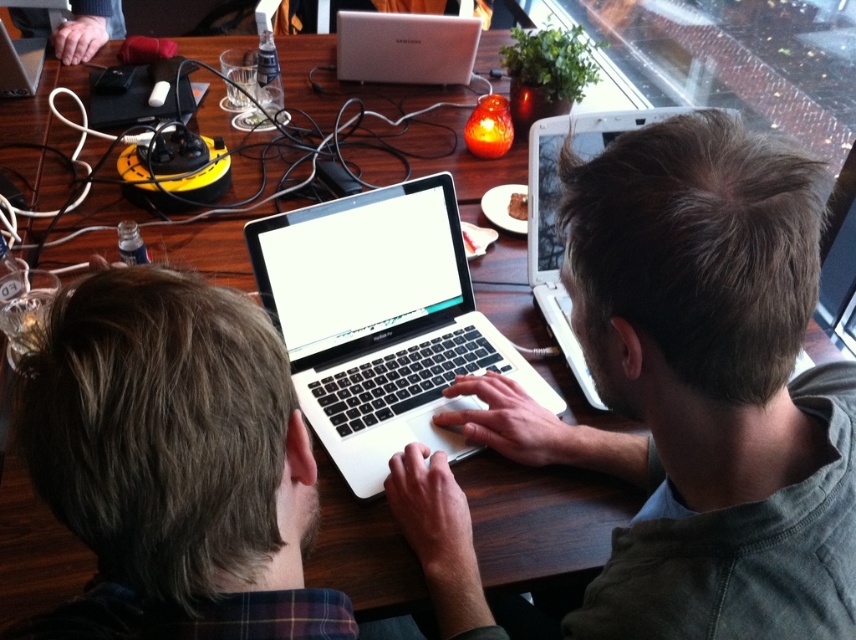
Question: Which point appears closest to the camera in this image?

Choices:
 (A) (354, 28)
 (B) (625, 627)
 (C) (314, 264)
 (D) (652, 115)

Answer: (B)

Question: Which point is farther from the camera taking this photo?

Choices:
 (A) (611, 563)
 (B) (462, 83)

Answer: (B)

Question: Does silver metallic laptop at upper center appear on the right side of satin silver laptop at upper center?

Choices:
 (A) no
 (B) yes

Answer: (B)

Question: Which of the following is the farthest from the observer?

Choices:
 (A) (464, 44)
 (B) (397, 408)

Answer: (A)

Question: Does silver metallic laptop at upper center have a lesser width compared to satin silver laptop at upper center?

Choices:
 (A) yes
 (B) no

Answer: (A)

Question: Is silver metallic laptop at upper center wider than satin silver laptop at upper center?

Choices:
 (A) no
 (B) yes

Answer: (A)